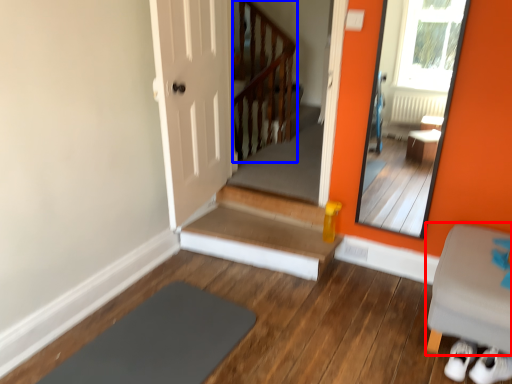
Question: Among these objects, which one is farthest to the camera, furniture (highlighted by a red box) or balustrade (highlighted by a blue box)?

Choices:
 (A) furniture
 (B) balustrade

Answer: (B)